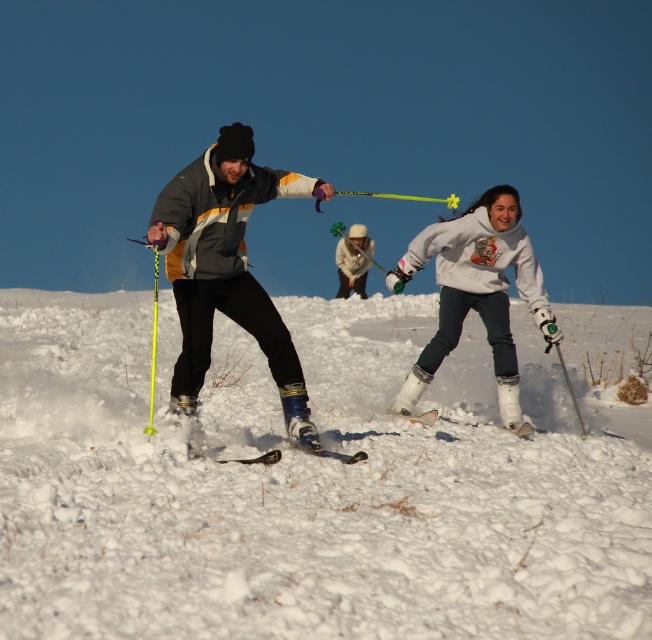
Question: Is white fluffy snow at center above white fleece jacket at center?

Choices:
 (A) no
 (B) yes

Answer: (A)

Question: Estimate the real-world distances between objects in this image. Which object is farther from the white fluffy snow at center?

Choices:
 (A) white matte snowboarder at center
 (B) black matte ski at center
 (C) matte gray jacket at center

Answer: (B)

Question: Is white fluffy snow at center smaller than white fleece jacket at center?

Choices:
 (A) no
 (B) yes

Answer: (A)

Question: Can you confirm if white matte snowboarder at center is positioned to the right of black matte ski at center?

Choices:
 (A) no
 (B) yes

Answer: (B)

Question: Which object appears farthest from the camera in this image?

Choices:
 (A) white fleece jacket at center
 (B) white fluffy snow at center

Answer: (A)

Question: Which object appears farthest from the camera in this image?

Choices:
 (A) white fluffy snow at center
 (B) matte gray jacket at center
 (C) black matte ski at center
 (D) white matte snowboarder at center

Answer: (D)